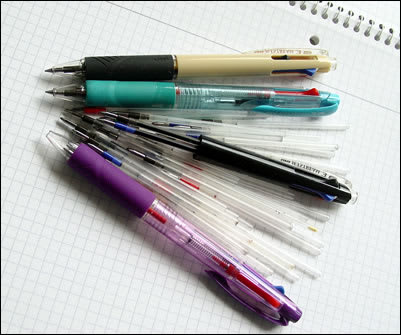
Locate an element on the screen. This screenshot has width=401, height=335. pens is located at coordinates (138, 206), (252, 165), (220, 93), (216, 76).